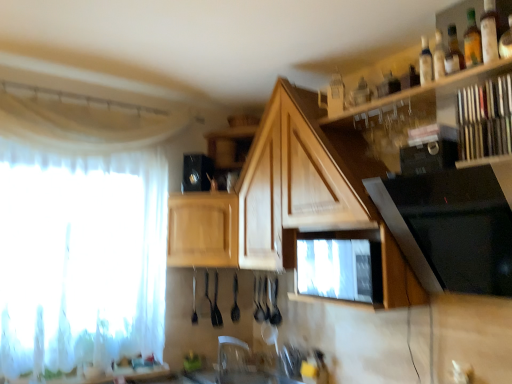
Question: Can you confirm if black glass stove at upper right, the 3th appliance positioned from the back, is thinner than clear glass bottle at upper right, the 2th bottle positioned from the front?

Choices:
 (A) no
 (B) yes

Answer: (A)

Question: Is the surface of black glass stove at upper right, the 1th appliance from the right, in direct contact with clear glass bottle at upper right, the 2th bottle from the right?

Choices:
 (A) yes
 (B) no

Answer: (B)

Question: Is black glass stove at upper right, the 3th appliance in the left-to-right sequence, further to the viewer compared to clear glass bottle at upper right, the 2th bottle positioned from the front?

Choices:
 (A) no
 (B) yes

Answer: (A)

Question: From the image's perspective, is black glass stove at upper right, the 1th appliance from the right, below clear glass bottle at upper right, the 2th bottle from the right?

Choices:
 (A) yes
 (B) no

Answer: (A)

Question: Is black glass stove at upper right, the 1th appliance from the right, oriented away from clear glass bottle at upper right, the first bottle viewed from the back?

Choices:
 (A) no
 (B) yes

Answer: (A)

Question: From the image's perspective, is black glass stove at upper right, the 3th appliance positioned from the back, located above or below translucent glass bottle at upper right, which appears as the 2th bottle when viewed from the back?

Choices:
 (A) above
 (B) below

Answer: (B)

Question: From a real-world perspective, relative to translucent glass bottle at upper right, which appears as the 1th bottle when viewed from the front, is black glass stove at upper right, the 3th appliance in the left-to-right sequence, vertically above or below?

Choices:
 (A) above
 (B) below

Answer: (B)

Question: Does point (485, 251) appear closer or farther from the camera than point (464, 39)?

Choices:
 (A) farther
 (B) closer

Answer: (B)

Question: Is black glass stove at upper right, the 3th appliance positioned from the back, bigger or smaller than translucent glass bottle at upper right, which appears as the 1th bottle when viewed from the front?

Choices:
 (A) small
 (B) big

Answer: (B)

Question: In the image, is white sheer curtain at left on the left side or the right side of clear plastic faucet at center?

Choices:
 (A) left
 (B) right

Answer: (A)

Question: Looking at their shapes, would you say white sheer curtain at left is wider or thinner than clear plastic faucet at center?

Choices:
 (A) wide
 (B) thin

Answer: (B)

Question: From the image's perspective, is white sheer curtain at left above or below clear plastic faucet at center?

Choices:
 (A) below
 (B) above

Answer: (B)

Question: Is white sheer curtain at left in front of or behind clear plastic faucet at center in the image?

Choices:
 (A) front
 (B) behind

Answer: (A)

Question: Is wooden shelf at upper right, the first shelf viewed from the left, wider or thinner than black glossy microwave at upper right, arranged as the 2th appliance when viewed from the right?

Choices:
 (A) thin
 (B) wide

Answer: (B)

Question: Considering their positions, is wooden shelf at upper right, the first shelf viewed from the left, located in front of or behind black glossy microwave at upper right, arranged as the 2th appliance when viewed from the right?

Choices:
 (A) front
 (B) behind

Answer: (A)